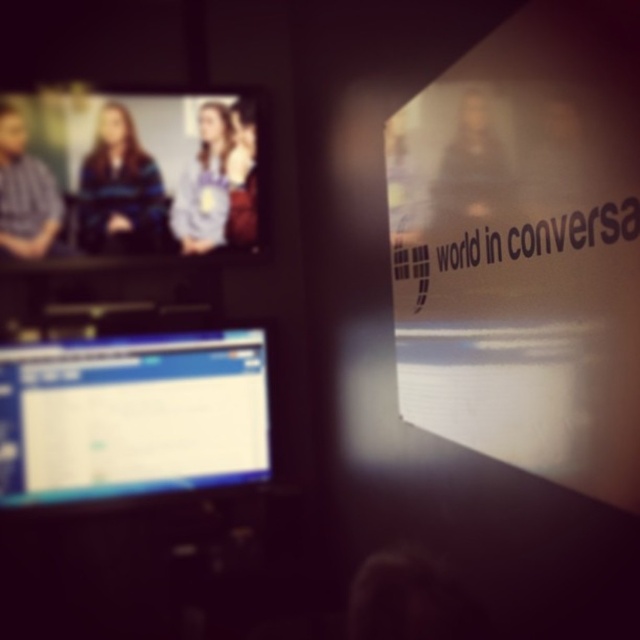
You are trying to locate the striped sweater at upper left in the image. According to the coordinates provided, where exactly is it positioned?

The striped sweater at upper left is positioned at coordinates point (120, 189).

You are a presenter standing at the front of the room. You need to adjust the focus of your camera to capture both the matte black monitor at lower left and the light blue shirt at upper center clearly. What is the minimum distance the camera needs to be from these objects to ensure both are in focus?

The minimum distance the camera needs to be from the matte black monitor at lower left and the light blue shirt at upper center to ensure both are in focus is 46.52 centimeters, as they are 46.52 centimeters apart from each other.

You are a tailor who needs to measure the distance between the striped sweater at upper left and the blue fabric shirt at upper left to ensure proper fitting. Given that the minimum required distance for accurate measurements is 10 inches, can you proceed with taking measurements between these two items?

The striped sweater at upper left and blue fabric shirt at upper left are 11.45 inches apart, which exceeds the minimum required distance of 10 inches. Therefore, you can proceed with taking measurements between these two items.